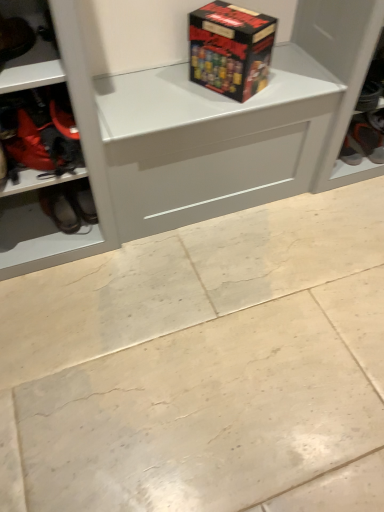
Question: Looking at their shapes, would you say red fabric boot at left, marked as the third footwear in a left-to-right arrangement, is wider or thinner than matt black box at upper center?

Choices:
 (A) thin
 (B) wide

Answer: (B)

Question: Is red fabric boot at left, marked as the third footwear in a left-to-right arrangement, spatially inside matt black box at upper center, or outside of it?

Choices:
 (A) outside
 (B) inside

Answer: (A)

Question: Estimate the real-world distances between objects in this image. Which object is farther from the red fabric boot at left, placed as the 2th footwear when sorted from right to left?

Choices:
 (A) matt black box at upper center
 (B) beige marble floor at center
 (C) matte black shoe at left, the first footwear viewed from the left
 (D) black leather shoes at lower left, which is the 3th footwear in front-to-back order
 (E) orange fabric shoe at right, the 4th footwear in the left-to-right sequence

Answer: (E)

Question: Based on their relative distances, which object is farther from the black leather shoes at lower left, positioned as the 2th footwear in back-to-front order?

Choices:
 (A) orange fabric shoe at right, the 1th footwear when ordered from back to front
 (B) matt black box at upper center
 (C) beige marble floor at center
 (D) red fabric boot at left, marked as the third footwear in a left-to-right arrangement
 (E) matte black shoe at left, which ranks as the 4th footwear in back-to-front order

Answer: (A)